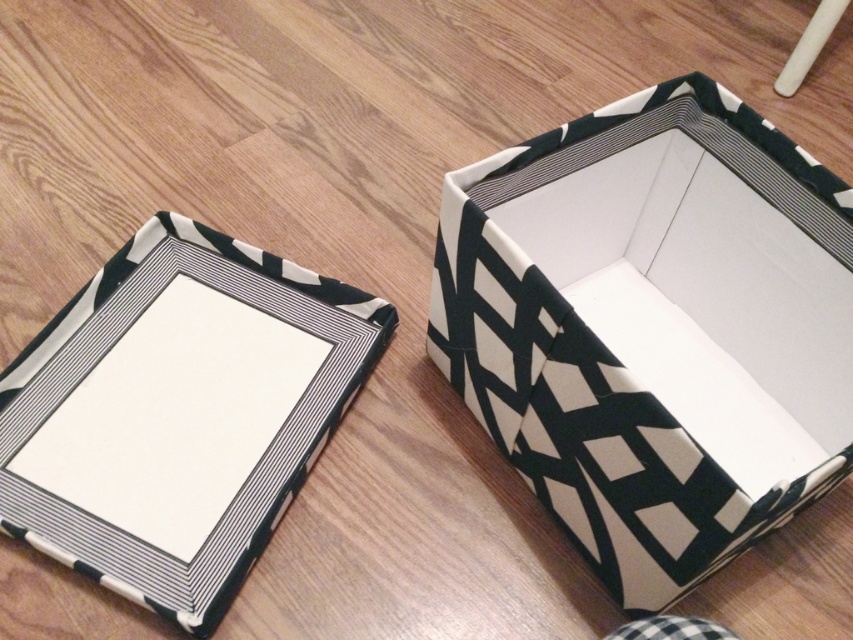
Is point (573, 323) farther from camera compared to point (135, 460)?

No, (573, 323) is in front of (135, 460).

Can you confirm if black and white patterned cardboard box at center is positioned above black and white patterned box at center?

Correct, black and white patterned cardboard box at center is located above black and white patterned box at center.

Is point (532, 296) in front of point (247, 332)?

Yes.

The width and height of the screenshot is (853, 640). What are the coordinates of `black and white patterned cardboard box at center` in the screenshot? It's located at (650, 324).